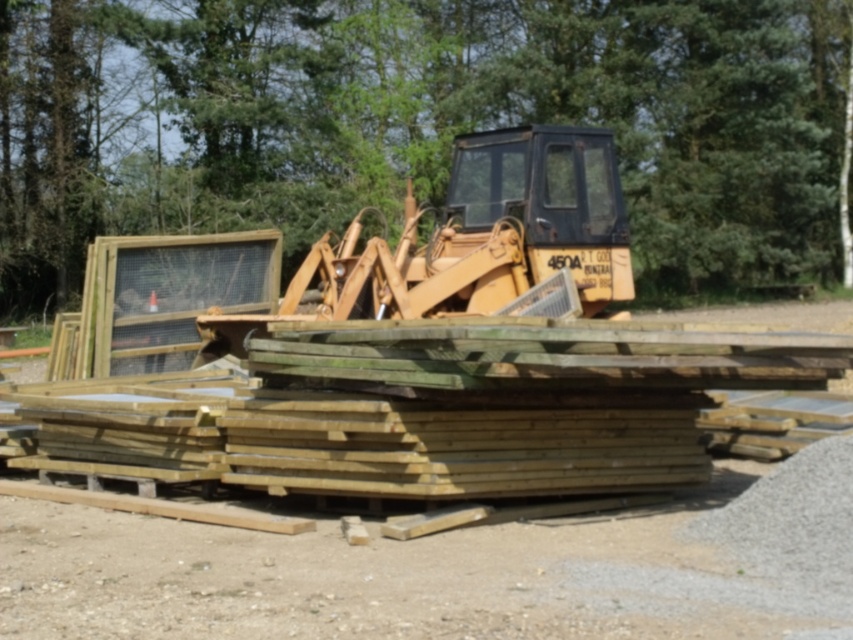
Question: Which object appears closest to the camera in this image?

Choices:
 (A) yellow metallic tractor at center
 (B) green leafy tree at upper center

Answer: (A)

Question: In this image, where is green leafy tree at upper center located relative to yellow metallic tractor at center?

Choices:
 (A) right
 (B) left

Answer: (A)

Question: Which object is closer to the camera taking this photo?

Choices:
 (A) yellow metallic tractor at center
 (B) green leafy tree at upper center

Answer: (A)

Question: In this image, where is green leafy tree at upper center located relative to yellow metallic tractor at center?

Choices:
 (A) below
 (B) above

Answer: (B)

Question: Does green leafy tree at upper center have a larger size compared to yellow metallic tractor at center?

Choices:
 (A) yes
 (B) no

Answer: (A)